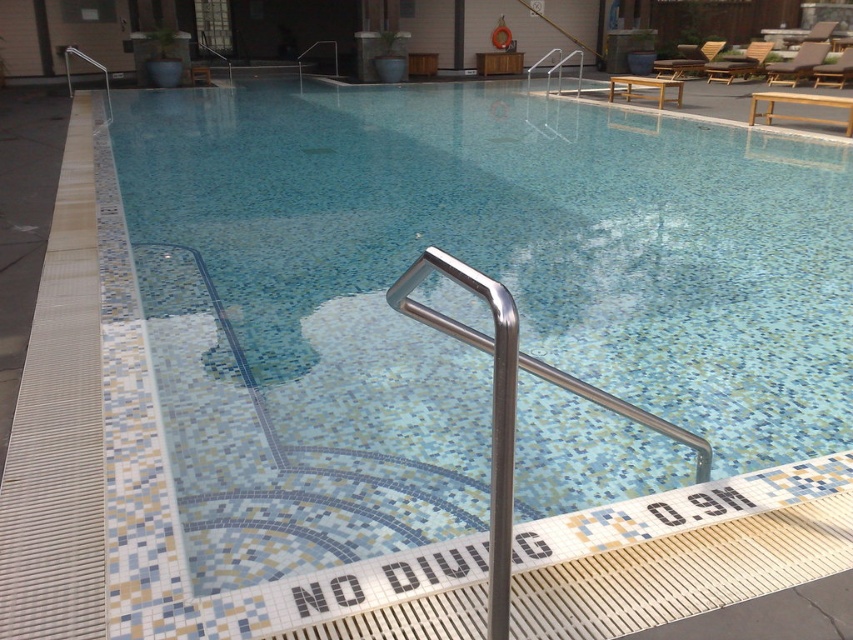
You are a lifeguard standing at the edge of the blue mosaic tile pool at center and need to reach the polished stainless steel handrail at center quickly. Which direction should you move to reach it?

The blue mosaic tile pool at center is positioned over the polished stainless steel handrail at center, so the handrail is underneath the pool. Since you are already at the edge of the pool, you can step down or move towards the edge to reach the handrail located beneath the pool.

You are standing at the entrance of the pool area and want to locate the blue mosaic tile pool at center. Which coordinates should you look towards?

You should look towards the coordinates point at (477, 268) to find the blue mosaic tile pool at center.